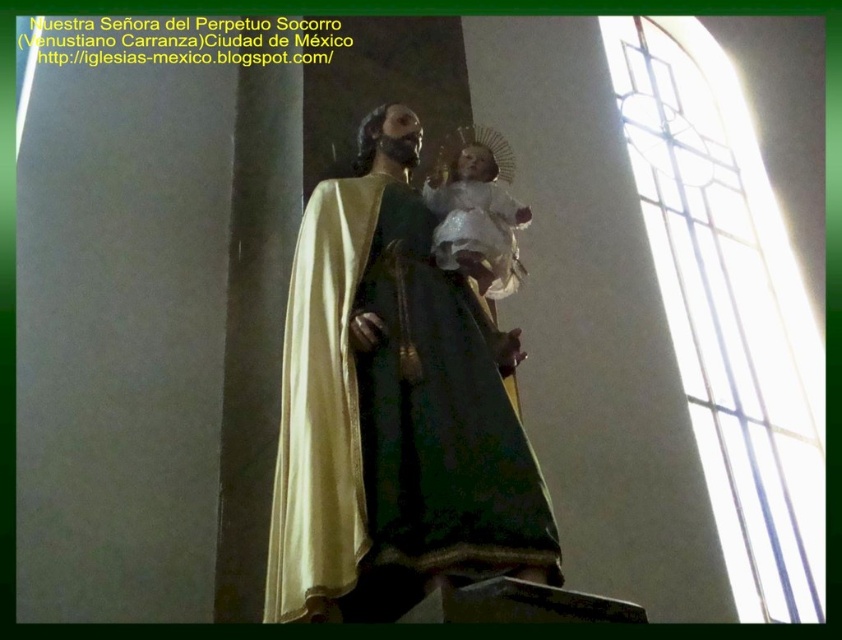
Measure the distance from gold polished statue at center to white porcelain baby at center.

gold polished statue at center and white porcelain baby at center are 19.10 feet apart from each other.

Between gold polished statue at center and white porcelain baby at center, which one appears on the right side from the viewer's perspective?

From the viewer's perspective, white porcelain baby at center appears more on the right side.

Measure the distance between gold polished statue at center and camera.

A distance of 115.09 feet exists between gold polished statue at center and camera.

Where is `gold polished statue at center`? The width and height of the screenshot is (842, 640). gold polished statue at center is located at coordinates (393, 408).